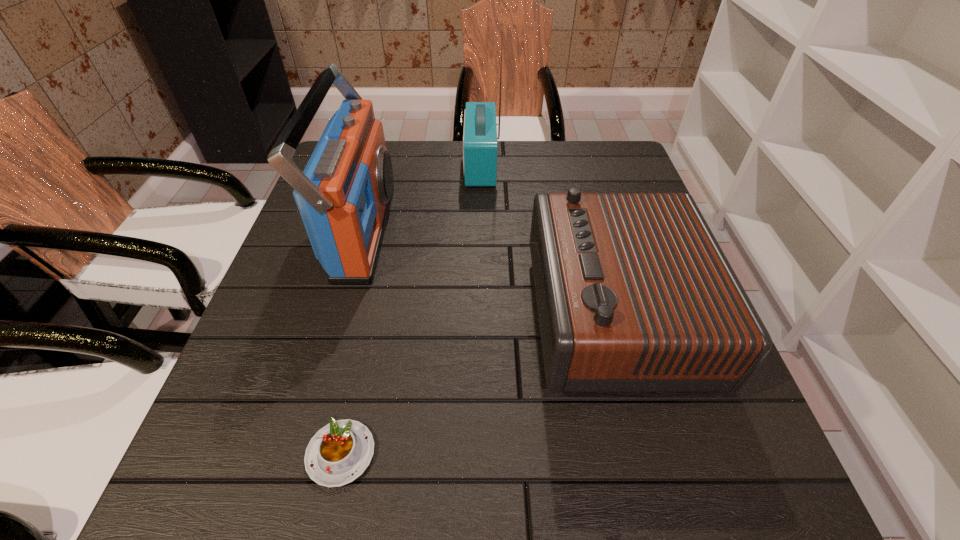
You are a GUI agent. You are given a task and a screenshot of the screen. Output one action in this format:
    pyautogui.click(x=<x>, y=<y>)
    Task: Click on the free space at the left edge of the desktop
    
    Given the screenshot: What is the action you would take?
    pyautogui.click(x=286, y=249)

Identify the location of vacant space at the right edge of the desktop. This screenshot has height=540, width=960. (732, 453).

In the image, there is a desktop. At what (x,y) coordinates should I click in order to perform the action: click on blank space at the far right corner. Please return your answer as a coordinate pair (x, y). Looking at the image, I should click on (585, 158).

At what (x,y) coordinates should I click in order to perform the action: click on vacant space in between the leftmost radio receiver and the third object from left to right. Please return your answer as a coordinate pair (x, y). The image size is (960, 540). Looking at the image, I should click on (421, 198).

In order to click on free point between the nearest object and the shortest radio receiver in this screenshot , I will do `click(476, 384)`.

Locate an element on the screen. The image size is (960, 540). free area in between the shortest object and the leftmost radio receiver is located at coordinates (351, 342).

Where is `vacant point located between the rightmost radio receiver and the leftmost radio receiver`? Image resolution: width=960 pixels, height=540 pixels. vacant point located between the rightmost radio receiver and the leftmost radio receiver is located at coordinates (488, 273).

Where is `unoccupied position between the leftmost radio receiver and the rightmost radio receiver`? unoccupied position between the leftmost radio receiver and the rightmost radio receiver is located at coordinates (488, 273).

Locate an element on the screen. free area in between the rightmost radio receiver and the leftmost radio receiver is located at coordinates (488, 273).

At what (x,y) coordinates should I click in order to perform the action: click on empty location between the nearest object and the rightmost object. Please return your answer as a coordinate pair (x, y). The height and width of the screenshot is (540, 960). Looking at the image, I should click on (476, 384).